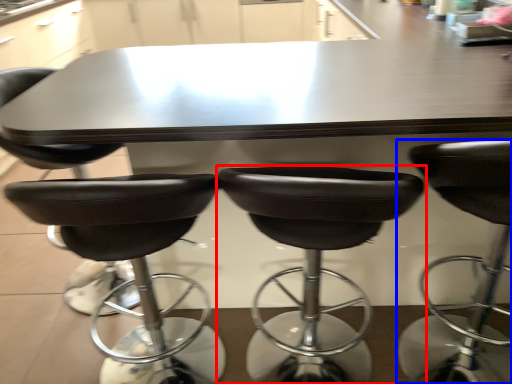
Question: Among these objects, which one is farthest to the camera, chair (highlighted by a red box) or chair (highlighted by a blue box)?

Choices:
 (A) chair
 (B) chair

Answer: (A)